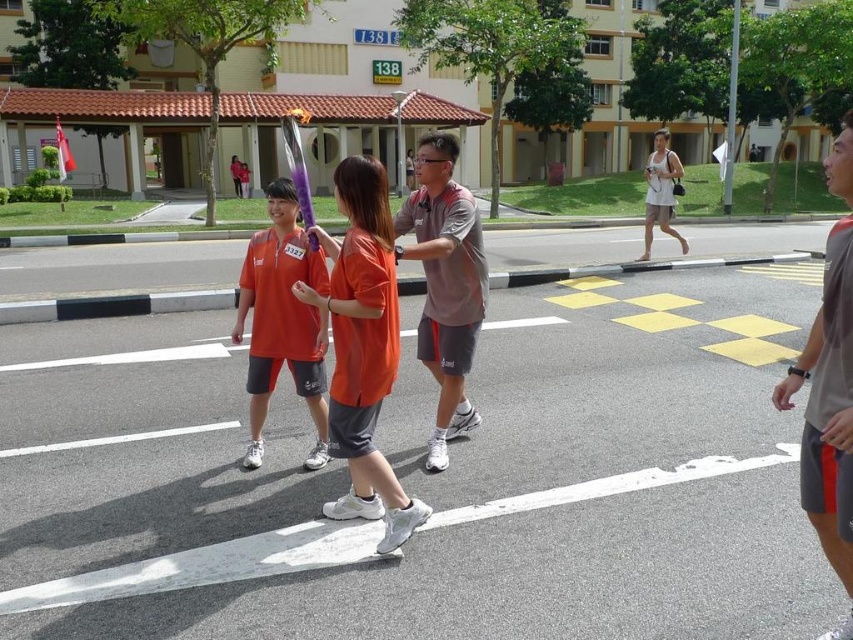
Looking at this image, you are a photographer standing in the middle of the relay event. You want to capture a photo of the participant wearing the gray fabric shorts at right. Where should you position your camera to ensure the shorts are in the frame?

Position your camera to the left side of the relay path so that the gray fabric shorts at right remain visible in the frame.

You are standing at the starting line of the relay event and see two points on the path ahead of you. The first point is at coordinates point [845,332], and the second point is at point [326,340]. Which point is closer to you?

Point [845,332] is in front of point [326,340], so the first point is closer to you.

You are a photographer standing at the starting line of the relay event. You want to take a photo that includes both the point at coordinates point (844,628) and point (459,365). Which point will appear larger in the photo?

Point (844,628) is closer to the camera than point (459,365), so it will appear larger in the photo.